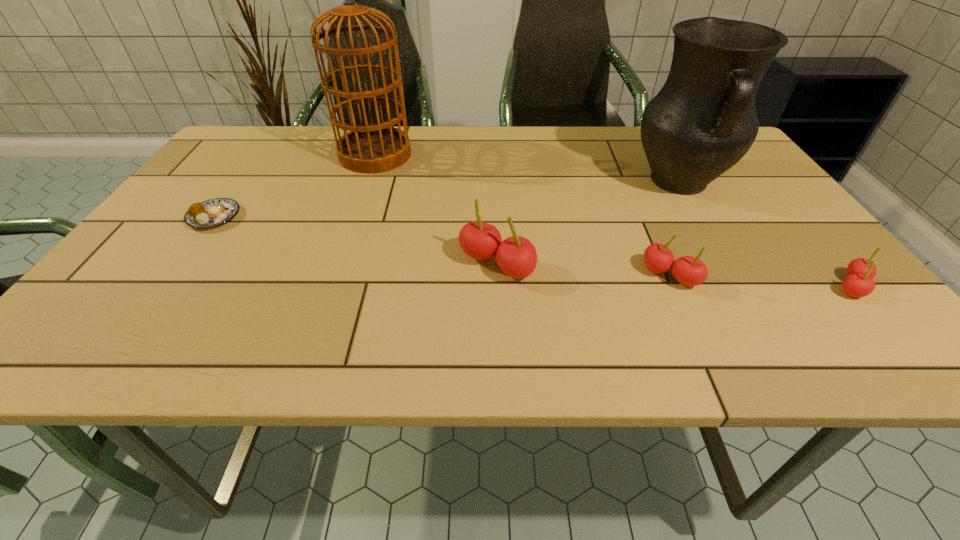
This screenshot has height=540, width=960. I want to click on cherry object that ranks as the second closest to the fourth shortest object, so click(x=859, y=283).

The height and width of the screenshot is (540, 960). What are the coordinates of `free space that satisfies the following two spatial constraints: 1. on the handle side of the second tallest object; 2. on the right side of the rightmost cherry` in the screenshot? It's located at (742, 286).

Where is `blank space that satisfies the following two spatial constraints: 1. on the front side of the rightmost object; 2. on the left side of the leftmost object`? blank space that satisfies the following two spatial constraints: 1. on the front side of the rightmost object; 2. on the left side of the leftmost object is located at coordinates (165, 286).

Identify the location of free space in the image that satisfies the following two spatial constraints: 1. on the front side of the shortest cherry; 2. on the right side of the fourth tallest object. (675, 286).

The image size is (960, 540). In order to click on vacant space that satisfies the following two spatial constraints: 1. on the back side of the pastry; 2. on the left side of the birdcage in this screenshot , I will do `click(259, 155)`.